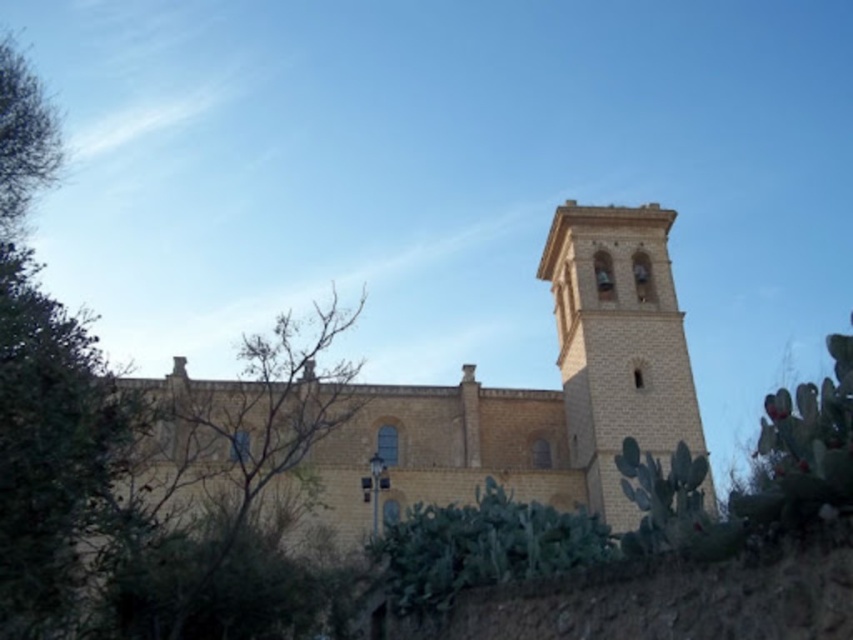
You are standing at the entrance of the historic stone building and want to take a photo of a specific point. The point you need to capture is located at coordinates point (x=48, y=131). Given that your camera has a maximum focus range of 250 feet, will you be able to focus on that point from your current position?

The distance of point (x=48, y=131) from camera is 240.74 feet, which is within the camera maximum focus range of 250 feet. Therefore, you can focus on that point from your current position.

You are standing in front of the historic stone building and want to know which of the two green leafy trees is taller. The trees are the green leafy tree at left and the green leafy tree at center. Can you determine which one is taller?

The green leafy tree at left is much taller than the green leafy tree at center, so the green leafy tree at left is taller.

You are standing in front of the historic stone building and want to take a photo of the light beige stone bell tower at center right. However, there is a green leafy tree at left blocking your view. Is the tree between you and the bell tower?

Yes, the green leafy tree at left is in front of the light beige stone bell tower at center right, so it is between you and the bell tower.